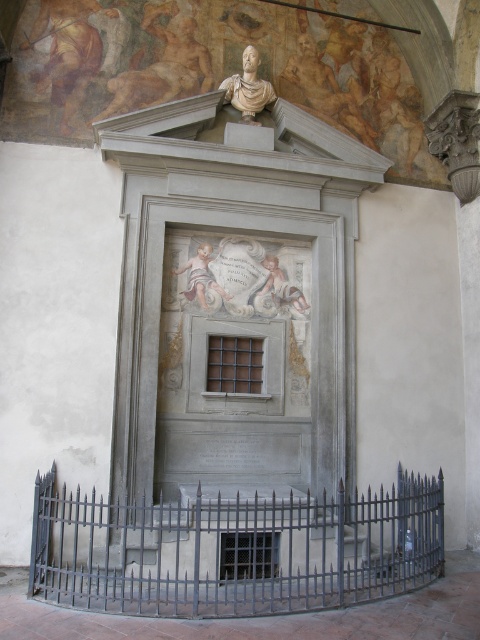
Which of these two, black metal fence at center or white marble bust at upper center, stands shorter?

white marble bust at upper center

Can you confirm if black metal fence at center is positioned above white marble bust at upper center?

No, black metal fence at center is not above white marble bust at upper center.

The image size is (480, 640). Describe the element at coordinates (235, 548) in the screenshot. I see `black metal fence at center` at that location.

This screenshot has height=640, width=480. Identify the location of black metal fence at center. (235, 548).

Does white marble plaque at center have a greater height compared to black metal fence at center?

Yes, white marble plaque at center is taller than black metal fence at center.

Does white marble plaque at center come in front of black metal fence at center?

No, white marble plaque at center is behind black metal fence at center.

Who is more forward, (159,260) or (253,579)?

Positioned in front is point (253,579).

Locate an element on the screen. The height and width of the screenshot is (640, 480). white marble plaque at center is located at coordinates (238, 360).

Can you confirm if white marble plaque at center is taller than white marble bust at upper center?

Indeed, white marble plaque at center has a greater height compared to white marble bust at upper center.

This screenshot has height=640, width=480. What do you see at coordinates (238, 360) in the screenshot? I see `white marble plaque at center` at bounding box center [238, 360].

Find the location of `white marble plaque at center`. white marble plaque at center is located at coordinates (238, 360).